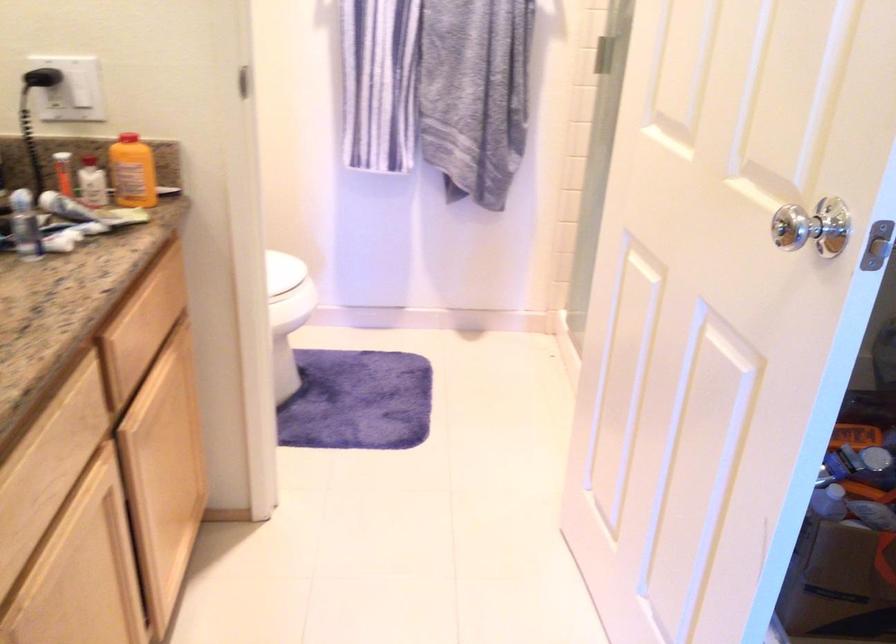
Where is `white light switch`? white light switch is located at coordinates (76, 88).